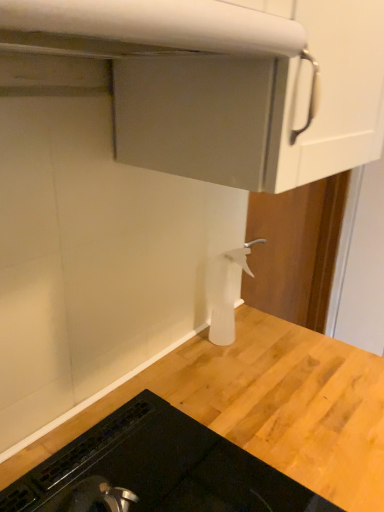
Question: From a real-world perspective, is white matte exhaust hood at upper center located higher than white plastic spray bottle at center?

Choices:
 (A) yes
 (B) no

Answer: (A)

Question: From the image's perspective, is white matte exhaust hood at upper center on top of white plastic spray bottle at center?

Choices:
 (A) yes
 (B) no

Answer: (A)

Question: Is white matte exhaust hood at upper center with white plastic spray bottle at center?

Choices:
 (A) no
 (B) yes

Answer: (A)

Question: From a real-world perspective, is white matte exhaust hood at upper center beneath white plastic spray bottle at center?

Choices:
 (A) no
 (B) yes

Answer: (A)

Question: Does white matte exhaust hood at upper center have a greater width compared to white plastic spray bottle at center?

Choices:
 (A) no
 (B) yes

Answer: (B)

Question: Considering the positions of black glass stovetop at lower left and white matte exhaust hood at upper center in the image, is black glass stovetop at lower left bigger or smaller than white matte exhaust hood at upper center?

Choices:
 (A) big
 (B) small

Answer: (A)

Question: In terms of height, does black glass stovetop at lower left look taller or shorter compared to white matte exhaust hood at upper center?

Choices:
 (A) tall
 (B) short

Answer: (A)

Question: Based on their positions, is black glass stovetop at lower left located to the left or right of white matte exhaust hood at upper center?

Choices:
 (A) right
 (B) left

Answer: (A)

Question: Is black glass stovetop at lower left in front of or behind white matte exhaust hood at upper center in the image?

Choices:
 (A) front
 (B) behind

Answer: (B)

Question: From a real-world perspective, is white plastic spray bottle at center above or below black glass stovetop at lower left?

Choices:
 (A) above
 (B) below

Answer: (A)

Question: From the image's perspective, is white plastic spray bottle at center positioned above or below black glass stovetop at lower left?

Choices:
 (A) above
 (B) below

Answer: (A)

Question: Considering the relative positions of white plastic spray bottle at center and black glass stovetop at lower left in the image provided, is white plastic spray bottle at center to the left or to the right of black glass stovetop at lower left?

Choices:
 (A) right
 (B) left

Answer: (A)

Question: From their relative heights in the image, would you say white plastic spray bottle at center is taller or shorter than black glass stovetop at lower left?

Choices:
 (A) short
 (B) tall

Answer: (B)

Question: In terms of width, does black glass stovetop at lower left look wider or thinner when compared to white plastic spray bottle at center?

Choices:
 (A) thin
 (B) wide

Answer: (B)

Question: From their relative heights in the image, would you say black glass stovetop at lower left is taller or shorter than white plastic spray bottle at center?

Choices:
 (A) short
 (B) tall

Answer: (A)